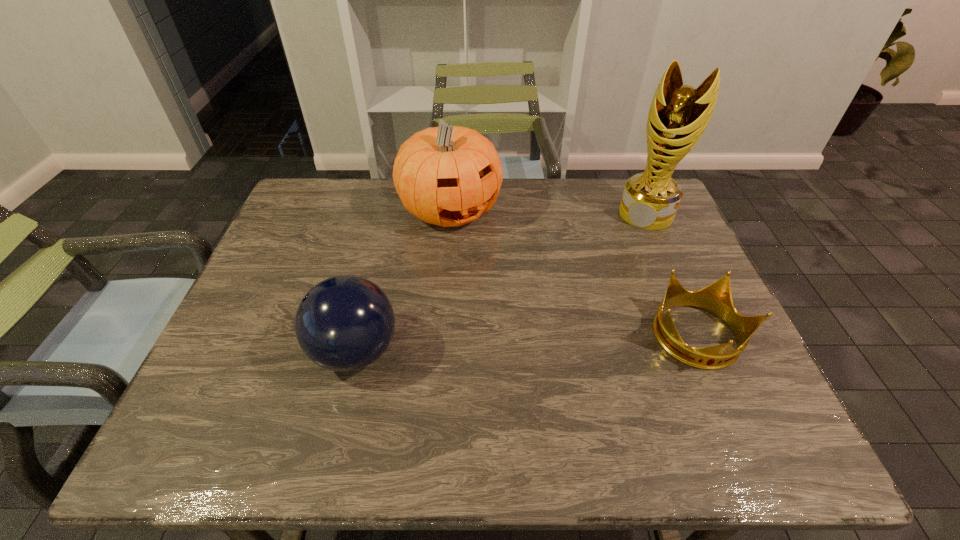
What are the coordinates of `vacant space located 0.200m on the front-facing side of the tallest object` in the screenshot? It's located at (613, 267).

Where is `blank area located on the front-facing side of the third shortest object`? blank area located on the front-facing side of the third shortest object is located at coordinates (529, 301).

Where is `vacant region located on the front-facing side of the third shortest object`? This screenshot has width=960, height=540. vacant region located on the front-facing side of the third shortest object is located at coordinates (516, 286).

The image size is (960, 540). I want to click on vacant space located on the front-facing side of the third shortest object, so point(516,286).

This screenshot has height=540, width=960. Find the location of `award present at the far edge`. award present at the far edge is located at coordinates (678, 115).

Locate an element on the screen. pumpkin present at the far edge is located at coordinates (449, 176).

What are the coordinates of `bowling ball located at the near edge` in the screenshot? It's located at (344, 323).

Identify the location of crown that is at the near edge. Image resolution: width=960 pixels, height=540 pixels. (716, 298).

Where is `crown that is at the right edge`? Image resolution: width=960 pixels, height=540 pixels. crown that is at the right edge is located at coordinates (716, 298).

Identify the location of award present at the right edge. The height and width of the screenshot is (540, 960). (678, 115).